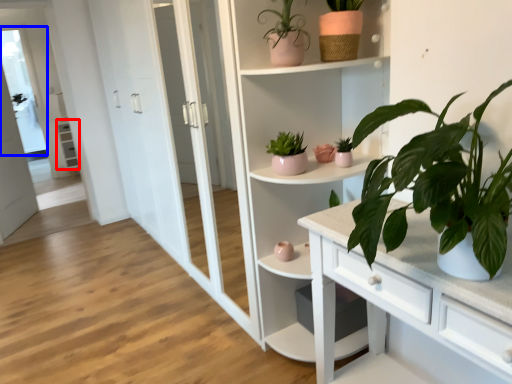
Question: Which object appears closest to the camera in this image, cabinet (highlighted by a red box) or window (highlighted by a blue box)?

Choices:
 (A) cabinet
 (B) window

Answer: (B)